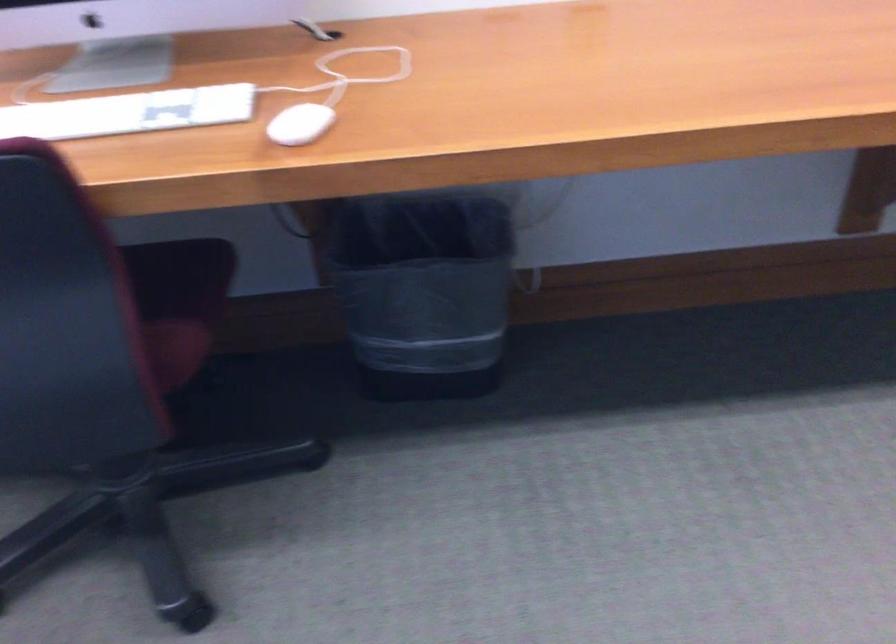
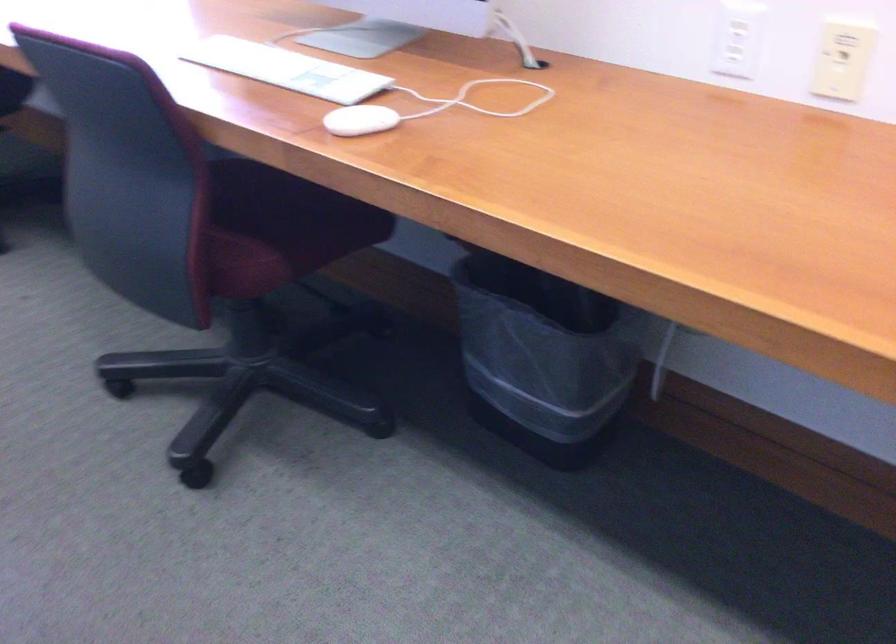
In the second image, find the point that corresponds to (x=112, y=114) in the first image.

(286, 69)